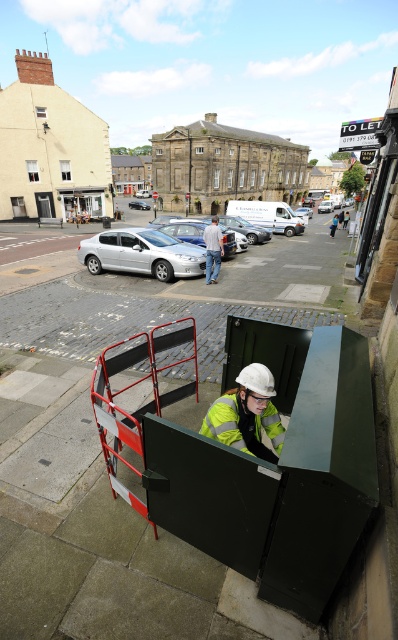
You are a pedestrian trying to cross the street. You see a metallic red barricade at center and a reflective yellow safety vest at center. Which object is closer to you?

The metallic red barricade at center is closer to you because it is in front of the reflective yellow safety vest at center.